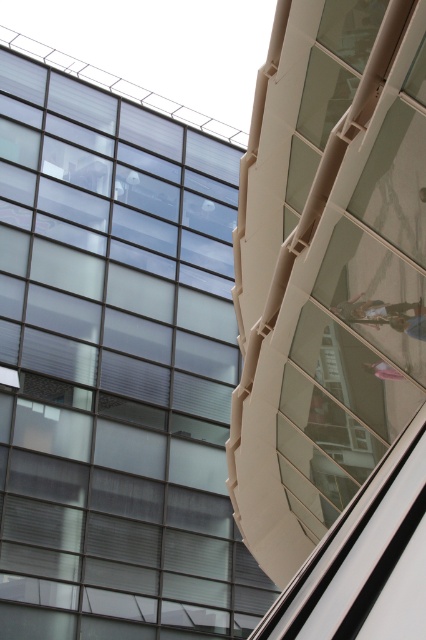
You are an architect designing a new building and want to ensure the transparent glass window at upper left and the metallic silver person at center are proportionally balanced. Given their sizes, which object should you scale down to achieve this balance?

The transparent glass window at upper left is bigger than the metallic silver person at center, so to achieve proportional balance, you should scale down the transparent glass window at upper left.

You are standing in front of the modern architectural scene. You see the transparent glass window at upper left and the metallic silver person at center. Which object is positioned higher up in the image?

The metallic silver person at center is positioned higher up in the image than the transparent glass window at upper left, as the window is located below the person.

You are standing in front of a modern building and see the transparent glass window at upper left and the metallic silver person at center. Which object is closer to the left edge of the building?

The transparent glass window at upper left is closer to the left edge of the building because it is positioned on the left side of the metallic silver person at center.